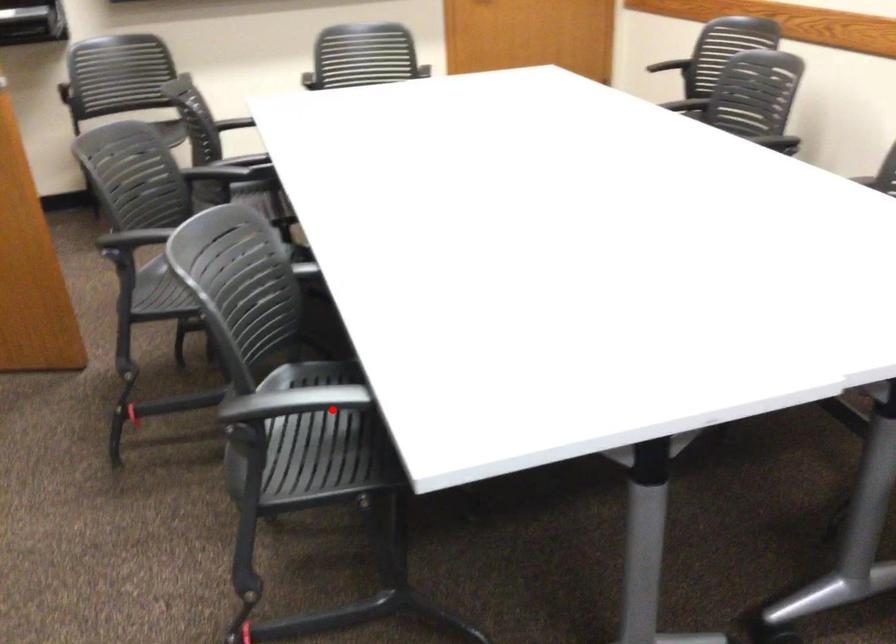
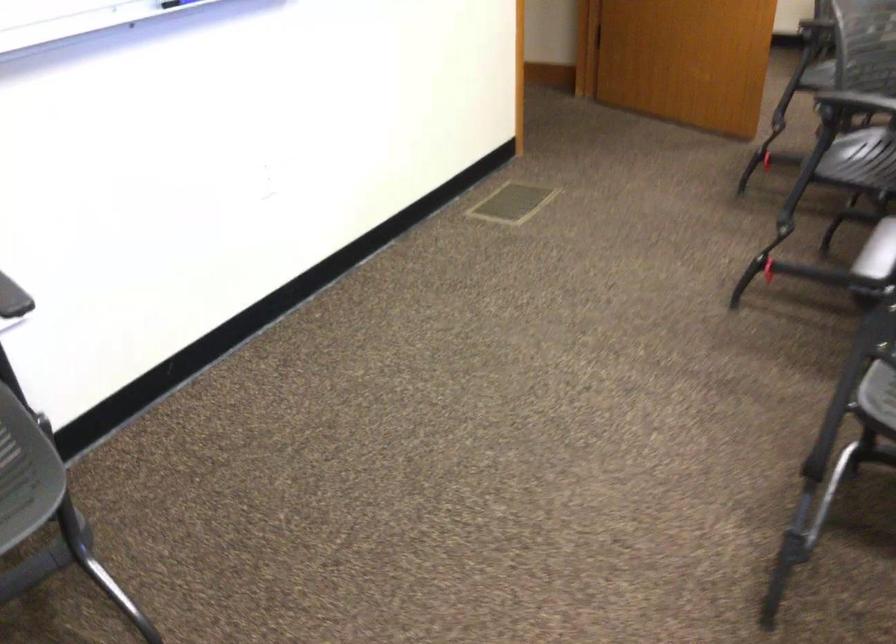
Where in the second image is the point corresponding to the highlighted location from the first image?

(857, 102)